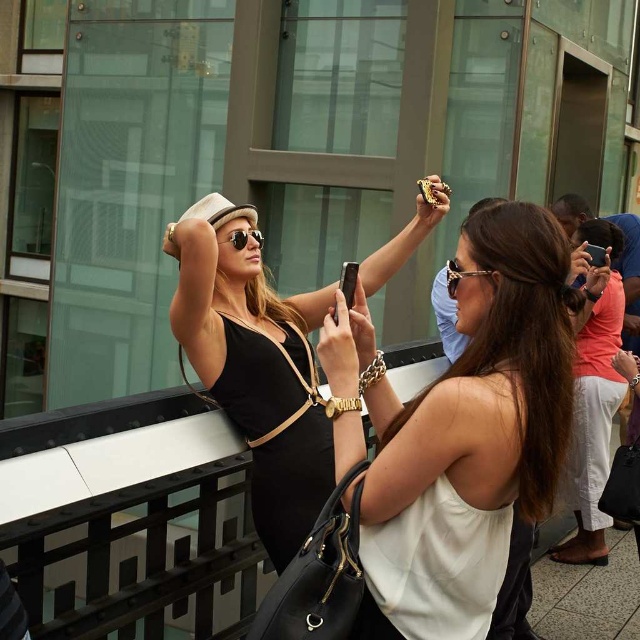
Is the position of white cotton pants at lower right less distant than that of matte black sunglasses at upper center?

That is False.

Between point (595, 241) and point (260, 236), which one is positioned in front?

Point (260, 236) is in front.

Identify the location of white cotton pants at lower right. The height and width of the screenshot is (640, 640). (593, 390).

Is matte black dress at center further to camera compared to matte black sunglasses at upper center?

No, matte black dress at center is in front of matte black sunglasses at upper center.

Locate an element on the screen. This screenshot has width=640, height=640. matte black dress at center is located at coordinates (256, 365).

Which is more to the left, white matte tank top at center or matte black dress at center?

From the viewer's perspective, matte black dress at center appears more on the left side.

From the picture: Is white matte tank top at center positioned behind matte black dress at center?

No.

In order to click on white matte tank top at center in this screenshot , I will do `click(468, 385)`.